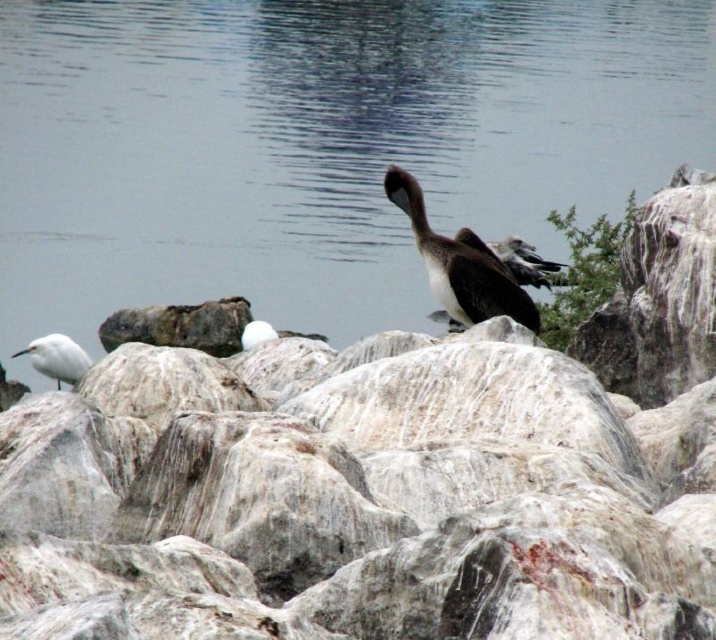
Question: Based on their relative distances, which object is farther from the brown matte bird at center?

Choices:
 (A) smooth gray water at center
 (B) white feathered bird at center
 (C) white matte bird at left

Answer: (A)

Question: From the image, what is the correct spatial relationship of smooth gray rock at center in relation to white matte bird at left?

Choices:
 (A) above
 (B) below

Answer: (B)

Question: Considering the relative positions of smooth gray rock at center and white matte bird at left in the image provided, where is smooth gray rock at center located with respect to white matte bird at left?

Choices:
 (A) above
 (B) below

Answer: (B)

Question: Does smooth gray water at center appear on the left side of brown matte bird at center?

Choices:
 (A) no
 (B) yes

Answer: (B)

Question: Which is farther from the white matte bird at left?

Choices:
 (A) smooth gray water at center
 (B) white feathered bird at center
 (C) smooth gray rock at center
 (D) brown matte bird at center

Answer: (A)

Question: Which object appears farthest from the camera in this image?

Choices:
 (A) smooth gray rock at center
 (B) white feathered bird at center
 (C) brown matte bird at center

Answer: (B)